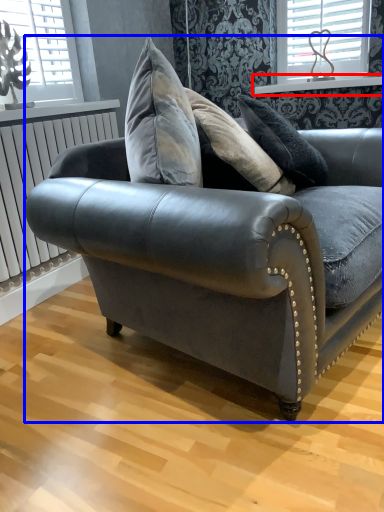
Question: Which object is further to the camera taking this photo, window sill (highlighted by a red box) or studio couch (highlighted by a blue box)?

Choices:
 (A) window sill
 (B) studio couch

Answer: (A)